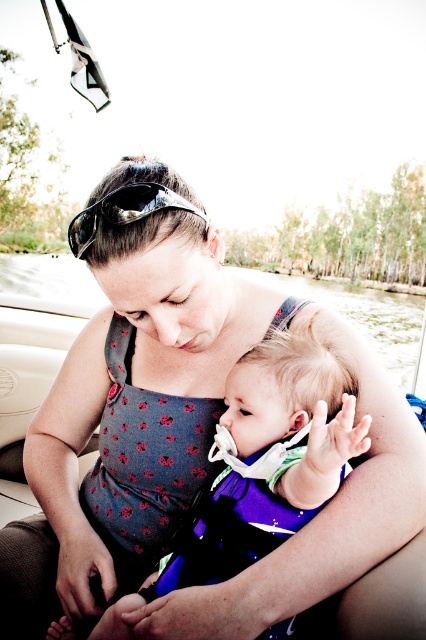
Question: Which object appears farthest from the camera in this image?

Choices:
 (A) shiny black sunglasses at center
 (B) purple fabric baby at center

Answer: (A)

Question: Can you confirm if purple fabric baby at center is positioned above shiny black sunglasses at center?

Choices:
 (A) no
 (B) yes

Answer: (A)

Question: Where is purple fabric baby at center located in relation to shiny black sunglasses at center in the image?

Choices:
 (A) below
 (B) above

Answer: (A)

Question: Can you confirm if purple fabric baby at center is positioned below shiny black sunglasses at center?

Choices:
 (A) no
 (B) yes

Answer: (B)